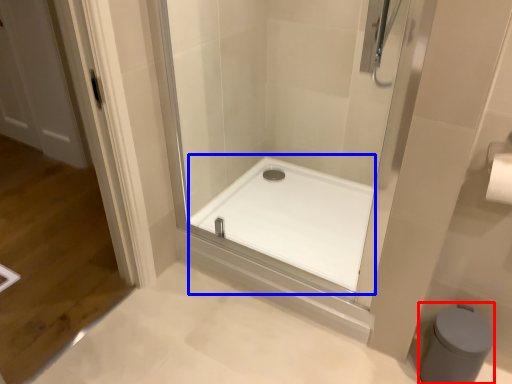
Question: Which object appears farthest to the camera in this image, bidet (highlighted by a red box) or bath (highlighted by a blue box)?

Choices:
 (A) bidet
 (B) bath

Answer: (B)